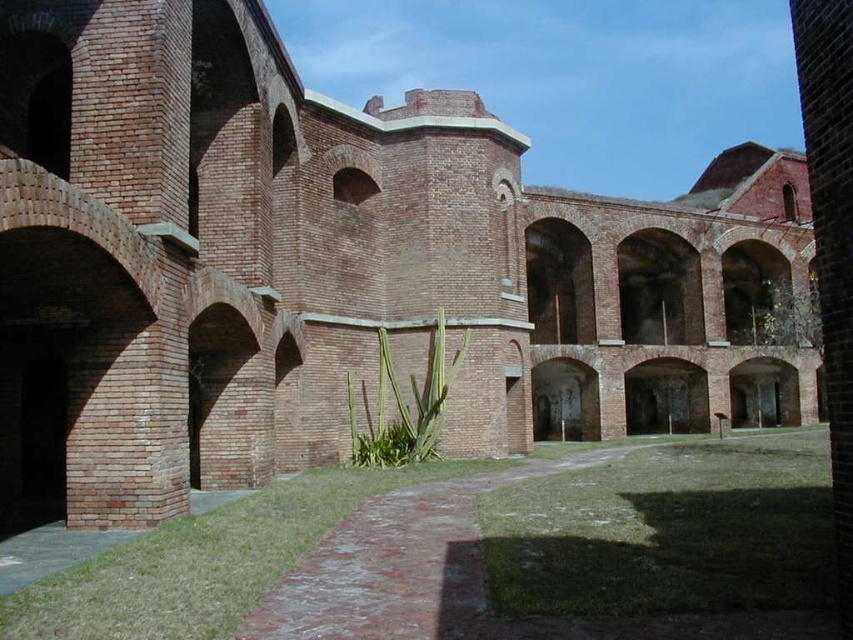
Between green grass at center and brick archway at center, which one appears on the right side from the viewer's perspective?

brick archway at center is more to the right.

The width and height of the screenshot is (853, 640). What are the coordinates of `green grass at center` in the screenshot? It's located at (666, 532).

Is point (554, 524) farther from camera compared to point (746, 384)?

No, it is in front of (746, 384).

Image resolution: width=853 pixels, height=640 pixels. Identify the location of green grass at center. (666, 532).

Who is positioned more to the right, green grass at center or smooth brick archway at center?

smooth brick archway at center is more to the right.

The image size is (853, 640). What do you see at coordinates (666, 532) in the screenshot?
I see `green grass at center` at bounding box center [666, 532].

Find the location of a particular element. green grass at center is located at coordinates (666, 532).

Between smooth brick archway at center and brick archway at center, which one is positioned lower?

brick archway at center is lower down.

Looking at this image, who is more forward, (566, 408) or (756, 396)?

Point (566, 408) is more forward.

Between point (561, 380) and point (735, 404), which one is positioned behind?

The point (735, 404) is behind.

Locate an element on the screen. The image size is (853, 640). smooth brick archway at center is located at coordinates (564, 401).